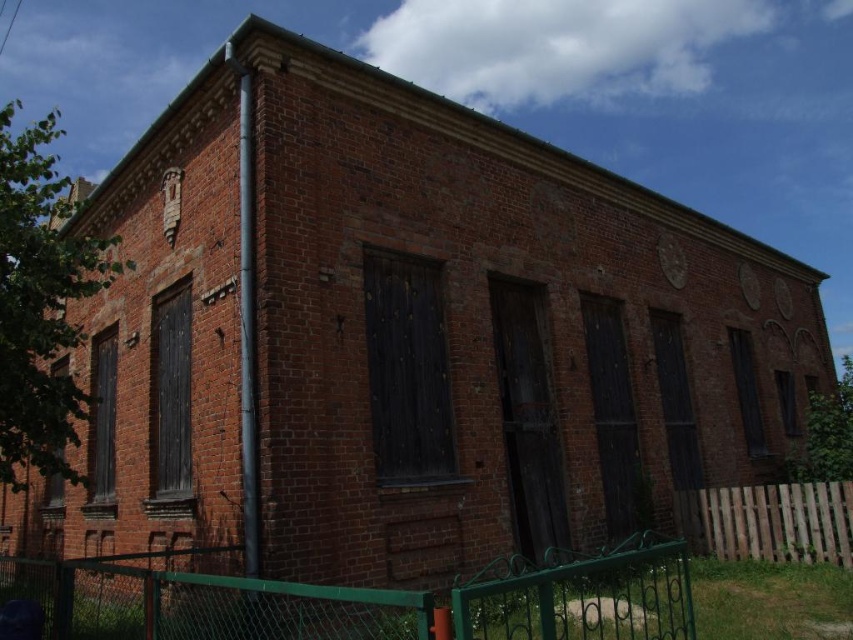
Between point (380, 596) and point (776, 547), which one is positioned behind?

Positioned behind is point (776, 547).

Who is more forward, (x=639, y=579) or (x=807, y=524)?

Point (x=639, y=579) is more forward.

The image size is (853, 640). Identify the location of green metal fence at lower center. (354, 600).